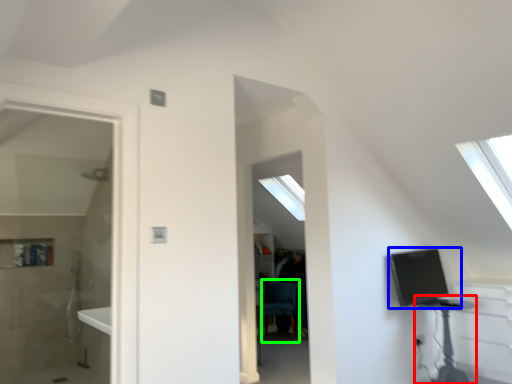
Question: Estimate the real-world distances between objects in this image. Which object is closer to table (highlighted by a red box), computer (highlighted by a blue box) or swivel chair (highlighted by a green box)?

Choices:
 (A) computer
 (B) swivel chair

Answer: (A)